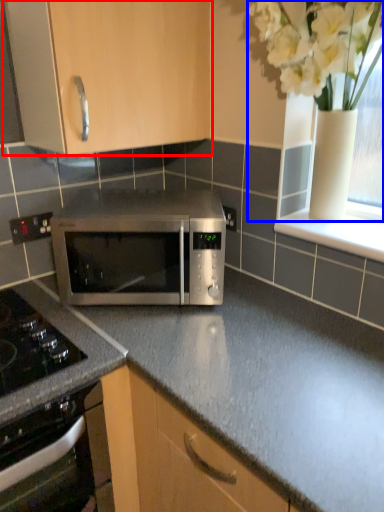
Question: Which point is closer to the camera, cabinetry (highlighted by a red box) or floral arrangement (highlighted by a blue box)?

Choices:
 (A) cabinetry
 (B) floral arrangement

Answer: (B)